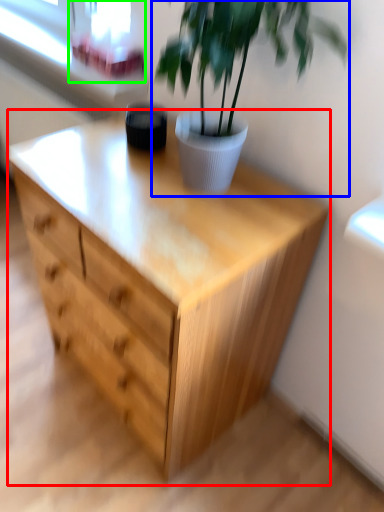
Question: Considering the real-world distances, which object is closest to chest of drawers (highlighted by a red box)? houseplant (highlighted by a blue box) or window screen (highlighted by a green box).

Choices:
 (A) houseplant
 (B) window screen

Answer: (A)